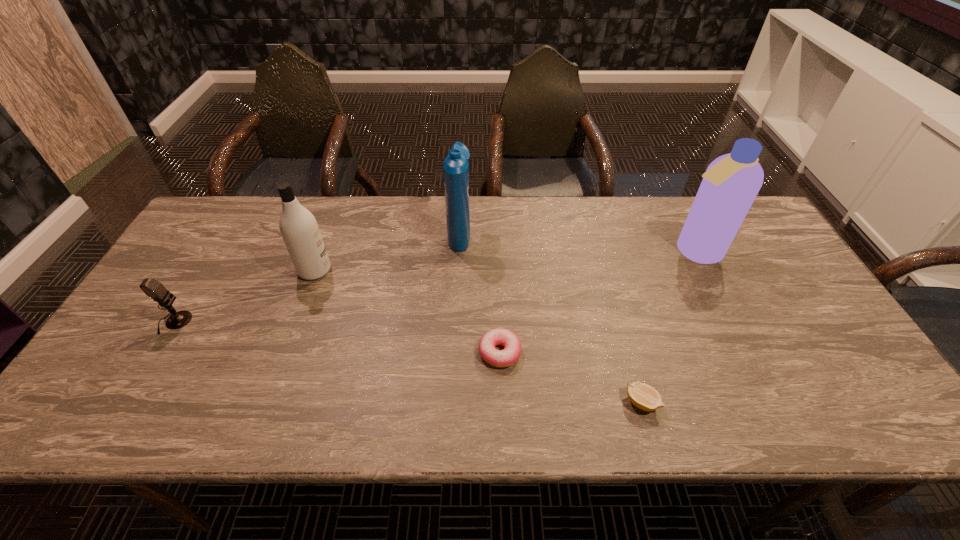
Locate an element on the screen. This screenshot has width=960, height=540. vacant area that lies between the second object from left to right and the third object from left to right is located at coordinates (387, 252).

Locate an element on the screen. The image size is (960, 540). empty space between the fourth object from right to left and the fourth object from left to right is located at coordinates (480, 293).

You are a GUI agent. You are given a task and a screenshot of the screen. Output one action in this format:
    pyautogui.click(x=<x>, y=<y>)
    Task: Click on the free point between the rightmost object and the second shampoo from right to left
    Image resolution: width=960 pixels, height=540 pixels.
    Given the screenshot: What is the action you would take?
    pyautogui.click(x=577, y=242)

In order to click on free spot between the second object from left to right and the third object from left to right in this screenshot , I will do `click(387, 252)`.

Locate an element on the screen. Image resolution: width=960 pixels, height=540 pixels. free space between the rightmost object and the nearest object is located at coordinates (668, 327).

Locate an element on the screen. empty location between the leftmost shampoo and the rightmost object is located at coordinates (504, 261).

Locate an element on the screen. empty location between the rightmost object and the lemon is located at coordinates (668, 327).

Locate an element on the screen. Image resolution: width=960 pixels, height=540 pixels. empty space between the rightmost object and the third object from right to left is located at coordinates (597, 302).

You are a GUI agent. You are given a task and a screenshot of the screen. Output one action in this format:
    pyautogui.click(x=<x>, y=<y>)
    Task: Click on the free space between the doughnut and the rightmost object
    Image resolution: width=960 pixels, height=540 pixels.
    Given the screenshot: What is the action you would take?
    tap(597, 302)

You are a GUI agent. You are given a task and a screenshot of the screen. Output one action in this format:
    pyautogui.click(x=<x>, y=<y>)
    Task: Click on the free space between the doughnut and the leftmost object
    
    Given the screenshot: What is the action you would take?
    pyautogui.click(x=337, y=337)